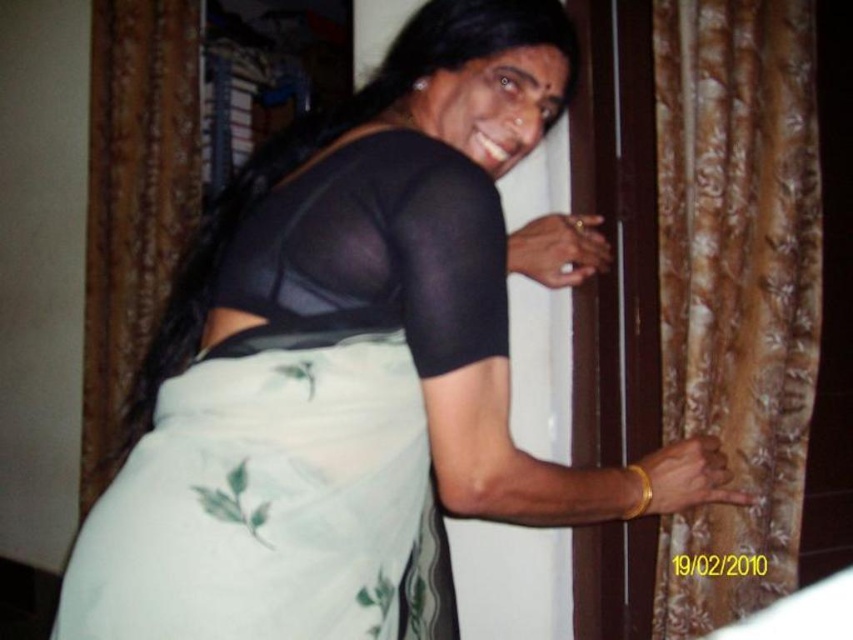
You are a fashion designer trying to decide whether to place a mannequin wearing the white sheer fabric dress at center in front of the gold floral fabric curtain at right. Based on the image, will the dress be wider than the curtain when displayed?

The white sheer fabric dress at center might be wider than gold floral fabric curtain at right, so there is a possibility that the dress could extend beyond the curtain when displayed.

You are a painter who needs to set up an easel between the gold floral fabric curtain at right and the brown textured curtain at left. The easel requires at least 1.5 meters of space to be placed. Can you fit the easel between them?

The distance between the gold floral fabric curtain at right and the brown textured curtain at left is 1.71 meters, which is more than the required 1.5 meters. Therefore, the easel can be placed between them.

You are a photographer setting up a shoot in this room. You want to position a model so that they are framed by the gold floral fabric curtain at right and the brown textured curtain at left. Which curtain should be placed higher to ensure the model is centered between them?

The gold floral fabric curtain at right is located below the brown textured curtain at left. To center the model between them, the brown textured curtain at left should be placed higher so that both curtains are aligned vertically.